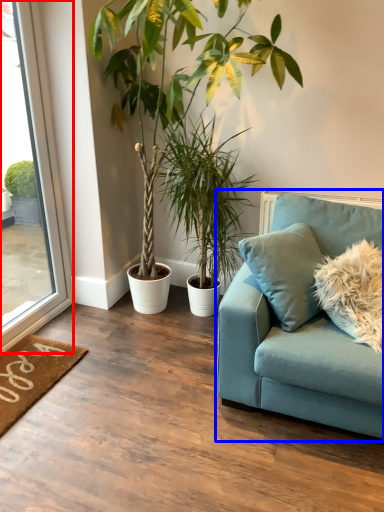
Question: Among these objects, which one is nearest to the camera, window (highlighted by a red box) or studio couch (highlighted by a blue box)?

Choices:
 (A) window
 (B) studio couch

Answer: (B)